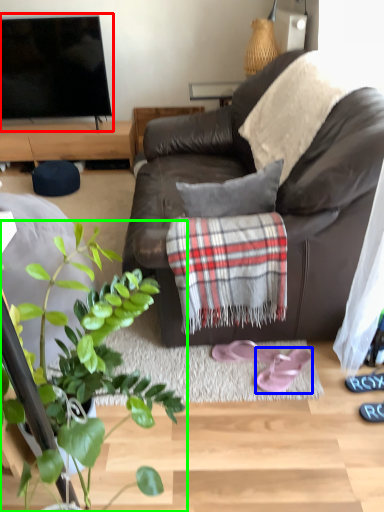
Question: Which object is the farthest from television (highlighted by a red box)? Choose among these: footwear (highlighted by a blue box) or houseplant (highlighted by a green box).

Choices:
 (A) footwear
 (B) houseplant

Answer: (A)